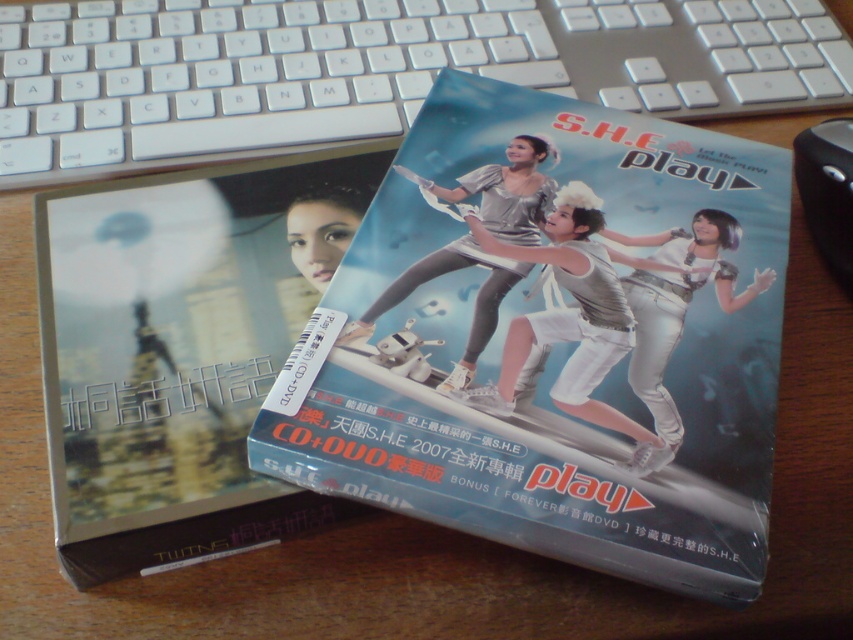
You are organizing items on a desk and need to place a new item between the CD case on the left and the mouse on the right. The keyboard is at point (372, 68). Where should you place the new item?

The new item should be placed between the CD case on the left and the mouse on the right, ensuring it is positioned to the right of the CD case on the left and to the left of the mouse on the right, while avoiding the keyboard at point (372, 68).

You are standing 5 feet away from the wooden desk. If you want to reach the point marked at coordinates point [796,35] on the CD case on the left, will you be able to do so without moving closer?

The distance of point [796,35] from camera is 3.64 feet, so you are currently 5 feet away from the wooden desk. Since the point is only 3.64 feet away from the camera, you need to move closer to reach it.